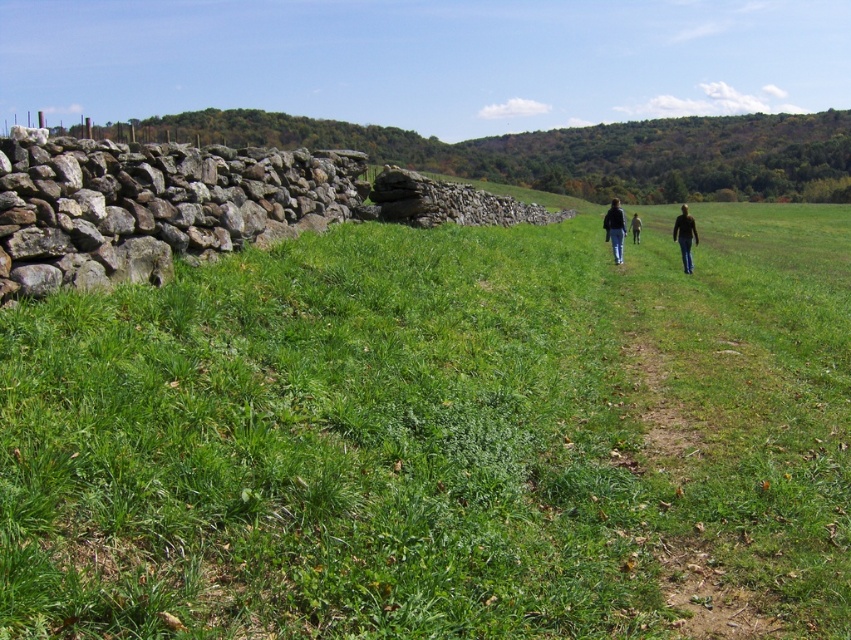
The height and width of the screenshot is (640, 851). Describe the element at coordinates (684, 236) in the screenshot. I see `dark brown leather jacket at center-right` at that location.

Locate an element on the screen. dark brown leather jacket at center-right is located at coordinates (684, 236).

Is point (687, 250) in front of point (631, 228)?

Yes, it is in front of point (631, 228).

Locate an element on the screen. Image resolution: width=851 pixels, height=640 pixels. dark brown leather jacket at center-right is located at coordinates point(684,236).

Between dark brown leather jacket at center and dark blue jeans at center, which one has more height?

Standing taller between the two is dark brown leather jacket at center.

From the picture: Measure the distance between dark brown leather jacket at center and dark blue jeans at center.

1.97 meters

Is point (615, 211) positioned behind point (606, 228)?

No, it is not.

This screenshot has width=851, height=640. Identify the location of dark brown leather jacket at center. (684, 236).

Does dark blue jeans at center appear on the left side of light brown leather jacket at center?

No, dark blue jeans at center is not to the left of light brown leather jacket at center.

Can you confirm if dark blue jeans at center is positioned below light brown leather jacket at center?

No.

Between point (604, 236) and point (632, 227), which one is positioned behind?

Positioned behind is point (632, 227).

The width and height of the screenshot is (851, 640). Identify the location of dark blue jeans at center. (615, 228).